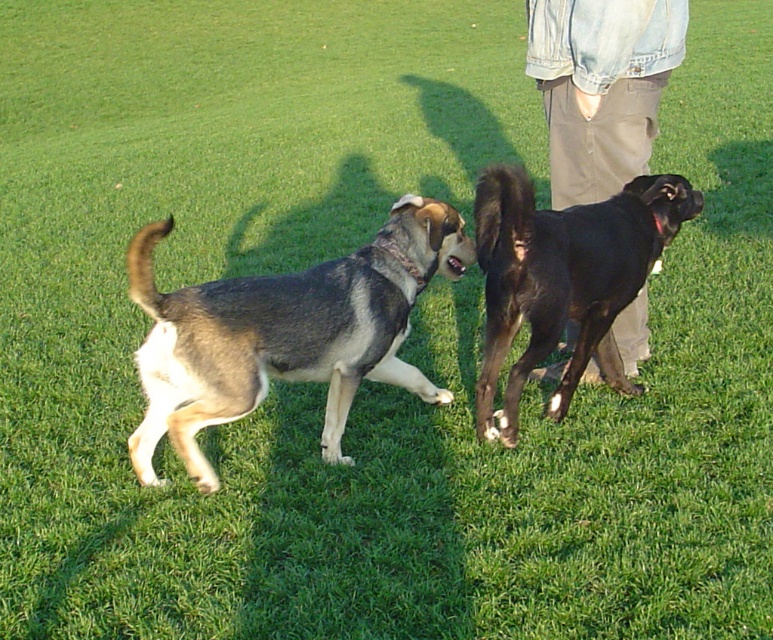
Does point (654, 248) come closer to viewer compared to point (646, 116)?

Yes, point (654, 248) is closer to viewer.

From the picture: Is black glossy dog at right wider than khaki pants at center?

Indeed, black glossy dog at right has a greater width compared to khaki pants at center.

Who is more forward, (x=475, y=196) or (x=586, y=180)?

Point (x=475, y=196)

Find the location of a particular element. This screenshot has width=773, height=640. black glossy dog at right is located at coordinates (564, 280).

Describe the element at coordinates (285, 332) in the screenshot. The image size is (773, 640). I see `gray-furred dog at center` at that location.

Does gray-furred dog at center appear on the left side of khaki pants at center?

Indeed, gray-furred dog at center is positioned on the left side of khaki pants at center.

The height and width of the screenshot is (640, 773). Find the location of `gray-furred dog at center`. gray-furred dog at center is located at coordinates (285, 332).

Between point (444, 266) and point (516, 376), which one is positioned in front?

Point (516, 376) is more forward.

Where is `gray-furred dog at center`? gray-furred dog at center is located at coordinates (285, 332).

Who is more distant from viewer, (186, 385) or (567, 276)?

Point (567, 276)

At what (x,y) coordinates should I click in order to perform the action: click on gray-furred dog at center. Please return your answer as a coordinate pair (x, y). The image size is (773, 640). Looking at the image, I should click on (285, 332).